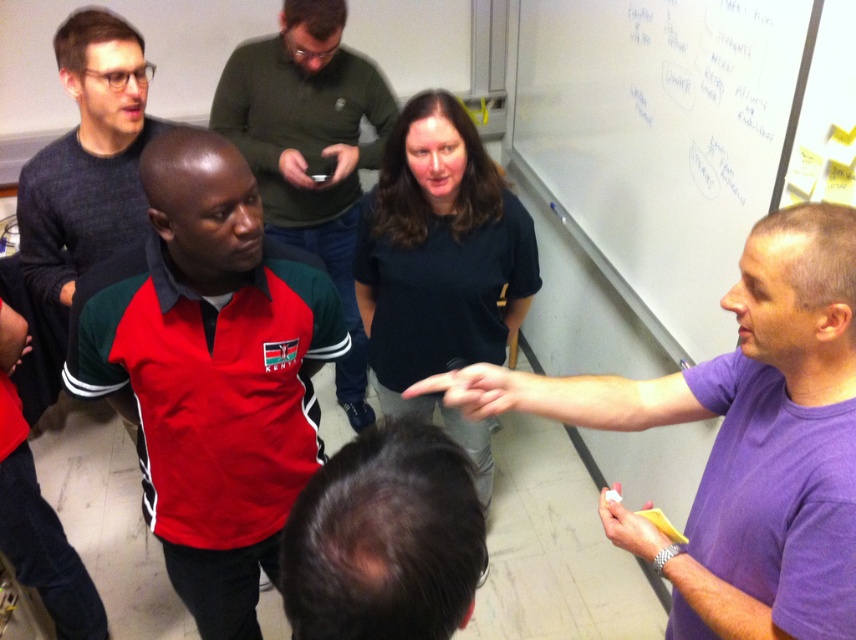
Find the location of a particular element. dark brown hair at center is located at coordinates (384, 538).

Locate an element on the screen. dark brown hair at center is located at coordinates (384, 538).

Is the position of red and green jersey at center more distant than that of matte gray sweater at upper left?

Yes, red and green jersey at center is behind matte gray sweater at upper left.

Between red and green jersey at center and matte gray sweater at upper left, which one is positioned higher?

matte gray sweater at upper left is above.

Where is `red and green jersey at center`? red and green jersey at center is located at coordinates (310, 150).

Is purple matte t-shirt at center shorter than black matte shirt at center?

Yes.

Is point (824, 262) closer to camera compared to point (467, 433)?

Yes, it is in front of point (467, 433).

At what (x,y) coordinates should I click in order to perform the action: click on purple matte t-shirt at center. Please return your answer as a coordinate pair (x, y). Looking at the image, I should click on (739, 440).